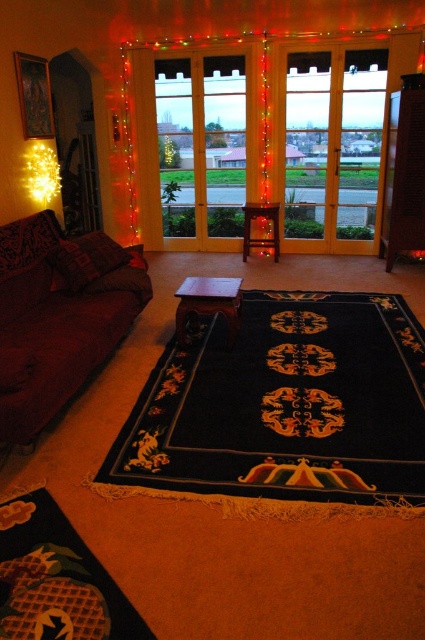
Based on the photo, you are standing in the living room and want to exit through the transparent glass door at center. However, the velvet dark red couch at left is blocking your path. Can you move around the couch to reach the door?

The velvet dark red couch at left is in front of the transparent glass door at center, so you can move around the couch to reach the door since it is blocking the path directly but not the sides.

You are a delivery person trying to enter the living room through the transparent glass door at center and clear glass window at center. Which one should you choose to enter the room?

The transparent glass door at center is larger in size than the clear glass window at center, so you should choose the transparent glass door at center to enter the room since it is bigger and more likely to be the entrance.

You are a guest in this living room and want to know if the clear glass window at center is taller than the yellow string lights at upper left. Can you confirm this?

The clear glass window at center is taller than yellow string lights at upper left according to the description.